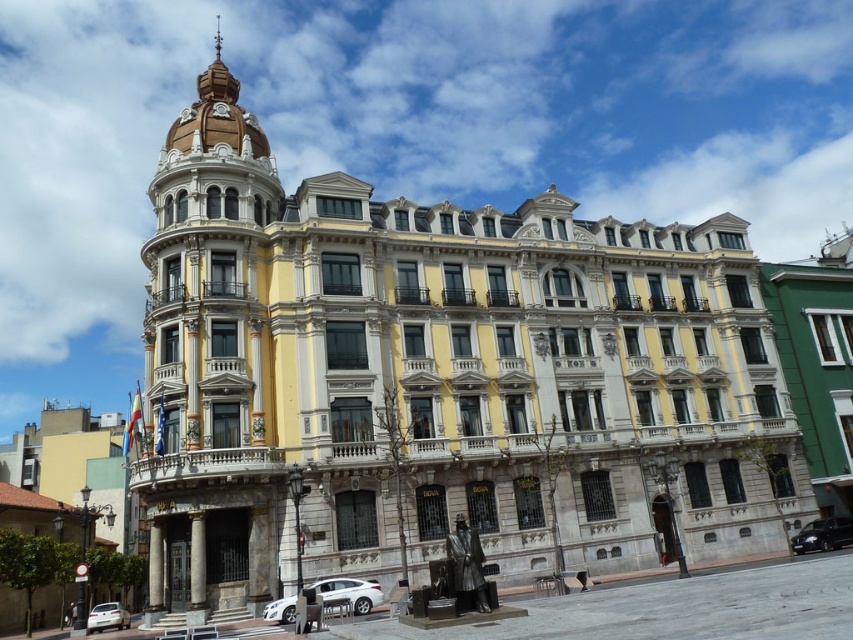
Question: Does metallic silver van at lower right have a lesser width compared to silver metallic clock at upper center?

Choices:
 (A) yes
 (B) no

Answer: (A)

Question: Which object is the closest to the metallic silver van at lower right?

Choices:
 (A) silver metallic clock at upper center
 (B) white matte car at lower left
 (C) white glossy car at center
 (D) gold textured clock at upper center

Answer: (C)

Question: Does white matte car at lower left appear on the right side of silver metallic clock at upper center?

Choices:
 (A) no
 (B) yes

Answer: (B)

Question: From the image, what is the correct spatial relationship of metallic silver van at lower right in relation to silver metallic clock at upper center?

Choices:
 (A) left
 (B) right

Answer: (B)

Question: Which of the following is the closest to the observer?

Choices:
 (A) (103, 604)
 (B) (827, 547)
 (C) (216, 104)
 (D) (316, 592)

Answer: (D)

Question: Which of these objects is positioned farthest from the white glossy car at center?

Choices:
 (A) metallic silver van at lower right
 (B) silver metallic clock at upper center

Answer: (B)